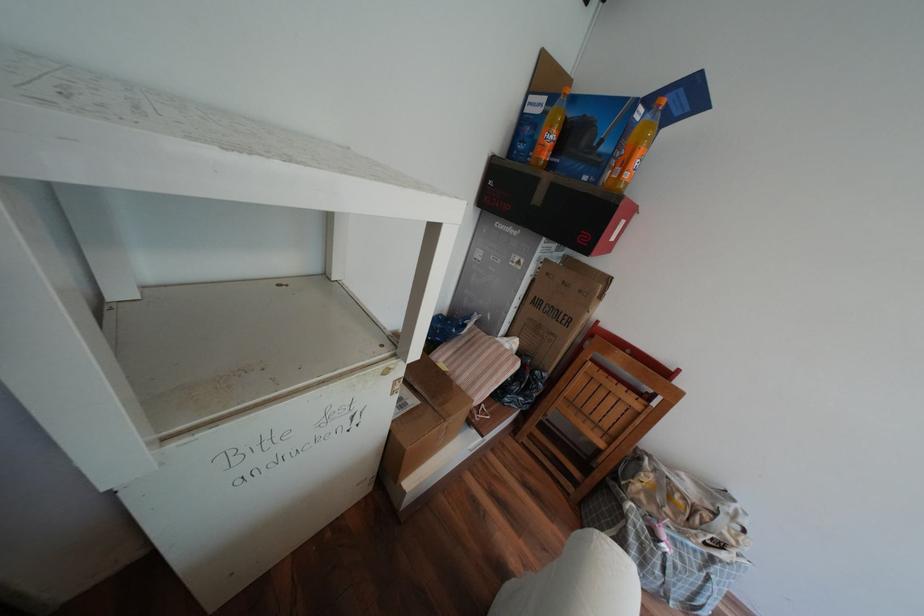
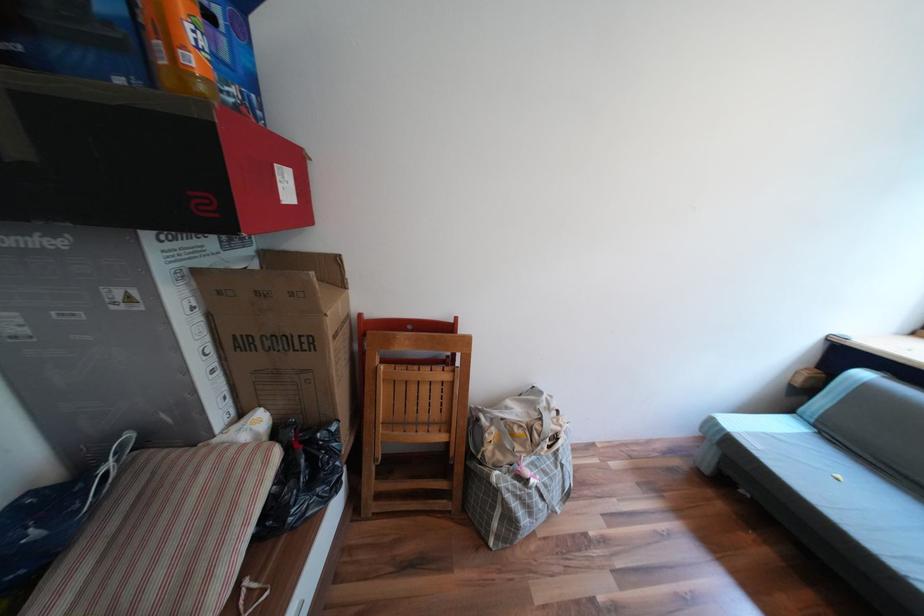
The point at [531,297] is marked in the first image. Where is the corresponding point in the second image?

(219, 349)